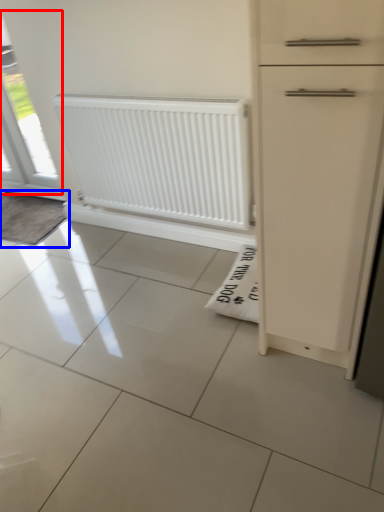
Question: Which of the following is the closest to the observer, window (highlighted by a red box) or doormat (highlighted by a blue box)?

Choices:
 (A) window
 (B) doormat

Answer: (A)